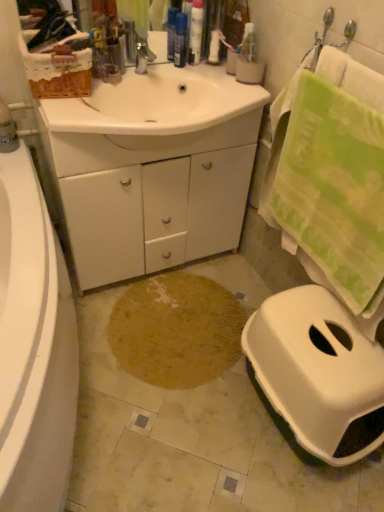
What are the coordinates of `vacant space in front of brown textured rug at center` in the screenshot? It's located at (191, 444).